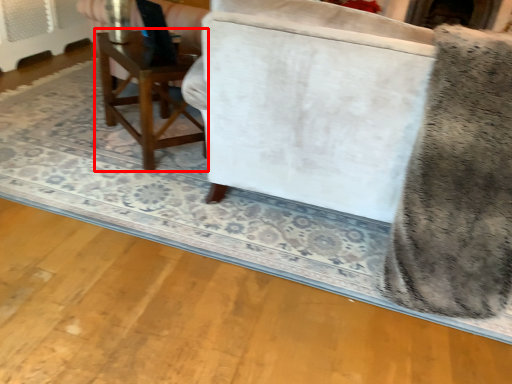
Question: From the image, what is the correct spatial relationship of table (annotated by the red box) in relation to swivel chair?

Choices:
 (A) left
 (B) right

Answer: (A)